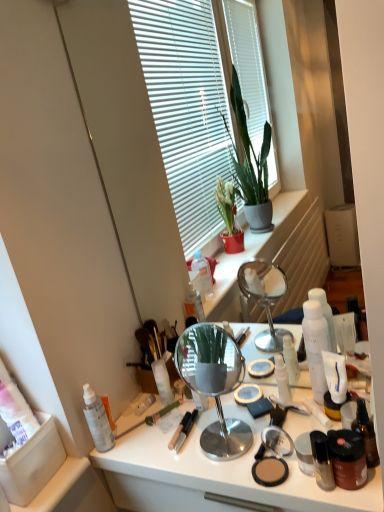
The image size is (384, 512). I want to click on vacant region to the left of shiny black bottle at lower right, which is counted as the fourth toiletry, starting from the left, so point(244,476).